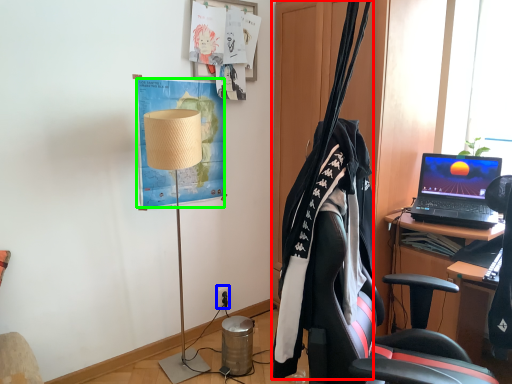
Question: Which is farther away from clothesline (highlighted by a red box)? power outlet (highlighted by a blue box) or poster (highlighted by a green box)?

Choices:
 (A) power outlet
 (B) poster

Answer: (A)